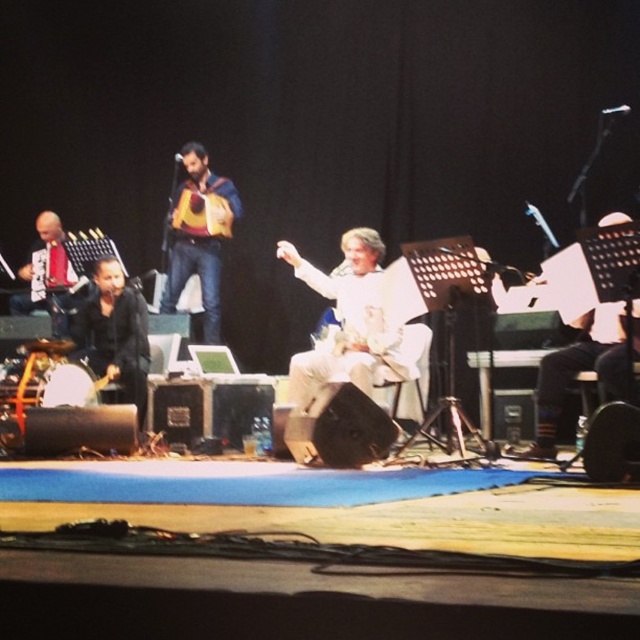
Question: Which object appears closest to the camera in this image?

Choices:
 (A) black leather jacket at lower left
 (B) white paper at right

Answer: (B)

Question: Which object is the farthest from the black leather jacket at lower left?

Choices:
 (A) white paper at right
 (B) matte black guitar at left

Answer: (A)

Question: Which object is positioned farthest from the black leather jacket at lower left?

Choices:
 (A) white fabric at center
 (B) white paper at right

Answer: (B)

Question: Does white paper at right appear over black leather jacket at lower left?

Choices:
 (A) no
 (B) yes

Answer: (A)

Question: Is white fabric at center to the left of brown leather guitar at center from the viewer's perspective?

Choices:
 (A) yes
 (B) no

Answer: (B)

Question: Does white paper at right appear over matte black guitar at left?

Choices:
 (A) yes
 (B) no

Answer: (B)